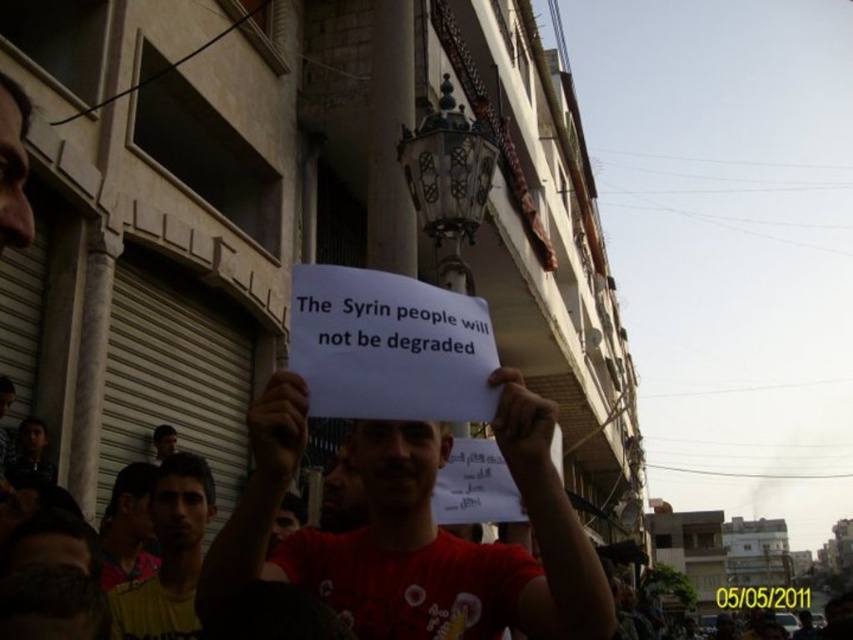
Which is below, white paper at center or yellow printed shirt at lower left?

yellow printed shirt at lower left is lower down.

Does white paper at center appear on the left side of yellow printed shirt at lower left?

Incorrect, white paper at center is not on the left side of yellow printed shirt at lower left.

At what (x,y) coordinates should I click in order to perform the action: click on white paper at center. Please return your answer as a coordinate pair (x, y). Looking at the image, I should click on (415, 531).

At what (x,y) coordinates should I click in order to perform the action: click on white paper at center. Please return your answer as a coordinate pair (x, y). This screenshot has height=640, width=853. Looking at the image, I should click on (415, 531).